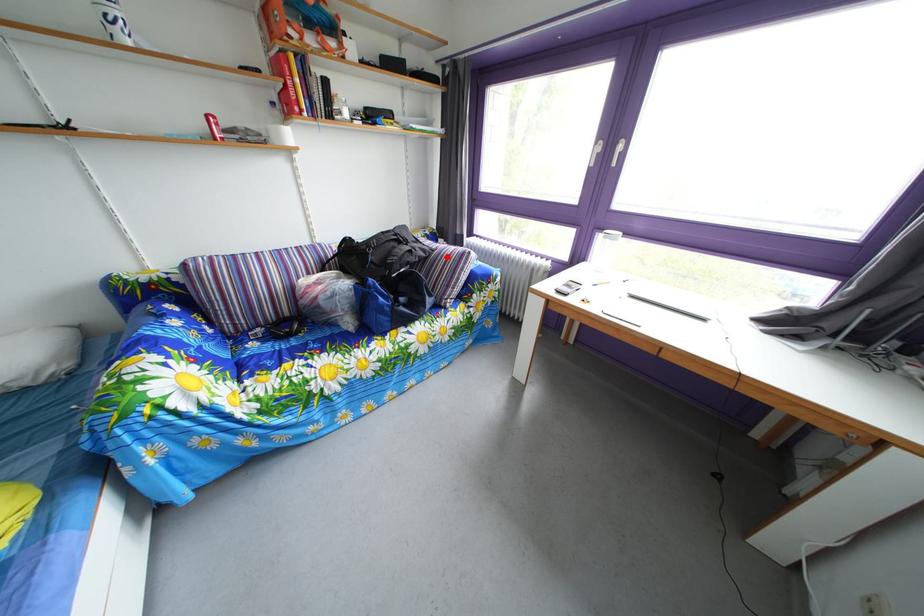
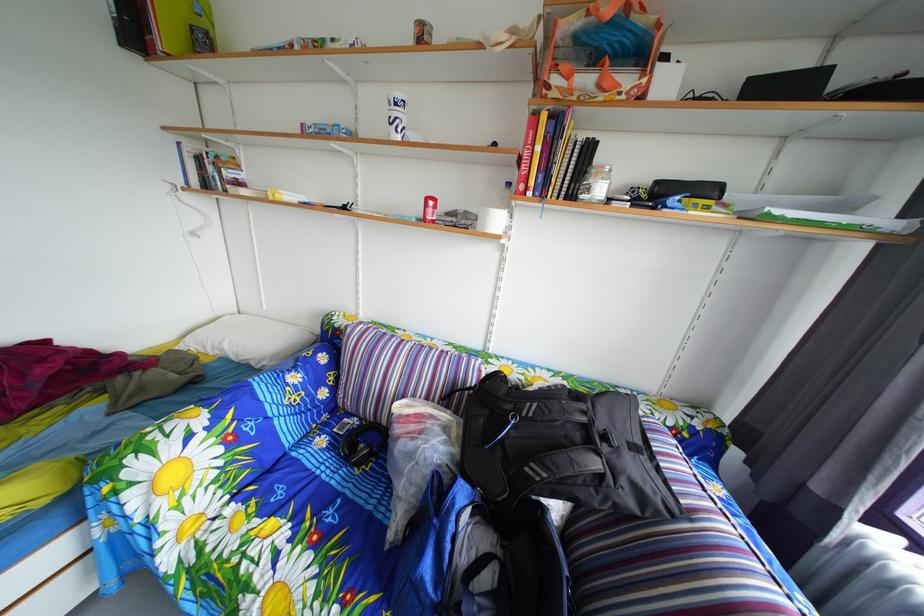
In the second image, find the point that corresponds to the highlighted location in the first image.

(699, 523)